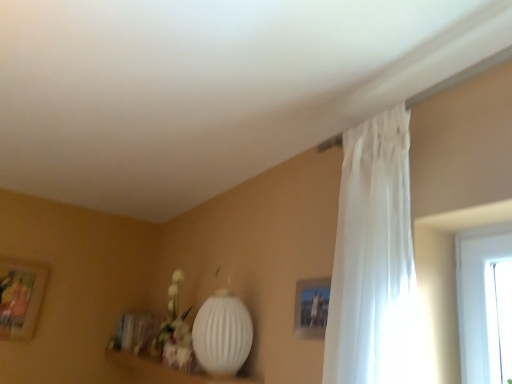
Question: Considering the positions of white matte vase at lower center and wooden picture frame at left in the image, is white matte vase at lower center taller or shorter than wooden picture frame at left?

Choices:
 (A) short
 (B) tall

Answer: (A)

Question: Is point (179, 332) closer or farther from the camera than point (33, 299)?

Choices:
 (A) farther
 (B) closer

Answer: (B)

Question: Which object is positioned farthest from the white matte vase at lower center?

Choices:
 (A) wooden picture frame at left
 (B) white sheer curtain at upper right
 (C) white ribbed lamp at lower center

Answer: (B)

Question: Which of these objects is positioned farthest from the white sheer curtain at upper right?

Choices:
 (A) wooden picture frame at left
 (B) white matte vase at lower center
 (C) white ribbed lamp at lower center

Answer: (A)